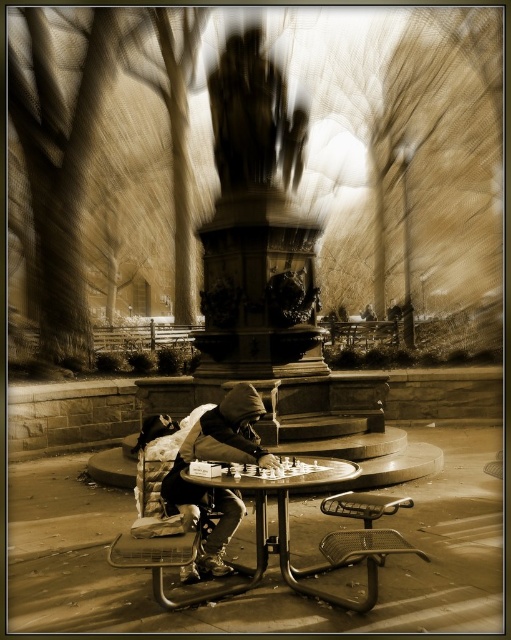
Question: Which point is closer to the camera taking this photo?

Choices:
 (A) (198, 577)
 (B) (286, 483)

Answer: (B)

Question: Is the position of dark gray hoodie at center more distant than that of smooth wooden table at center?

Choices:
 (A) yes
 (B) no

Answer: (A)

Question: Does dark gray hoodie at center appear over smooth wooden table at center?

Choices:
 (A) yes
 (B) no

Answer: (A)

Question: Can you confirm if dark gray hoodie at center is thinner than smooth wooden table at center?

Choices:
 (A) no
 (B) yes

Answer: (B)

Question: Which point appears closest to the camera in this image?

Choices:
 (A) (220, 433)
 (B) (350, 470)

Answer: (B)

Question: Among these objects, which one is nearest to the camera?

Choices:
 (A) smooth wooden table at center
 (B) dark gray hoodie at center

Answer: (A)